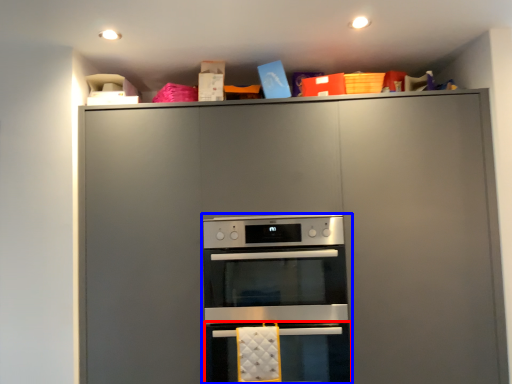
Question: Which object is further to the camera taking this photo, oven (highlighted by a red box) or oven (highlighted by a blue box)?

Choices:
 (A) oven
 (B) oven

Answer: (B)